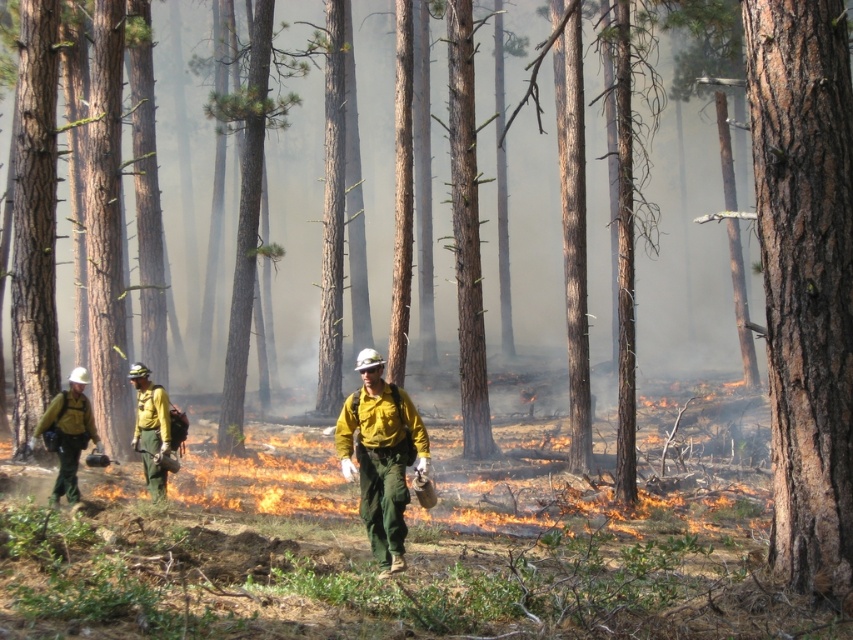
You are a firefighter navigating through the forest during a controlled burn. You need to reach the point at coordinates point (x=73, y=460) and point (x=138, y=420). Which coordinate should you head towards first if you want to reach the one that is closer to your current position?

Point (x=73, y=460) is in front of point (x=138, y=420), so you should head towards point (x=73, y=460) first as it is closer to your current position.